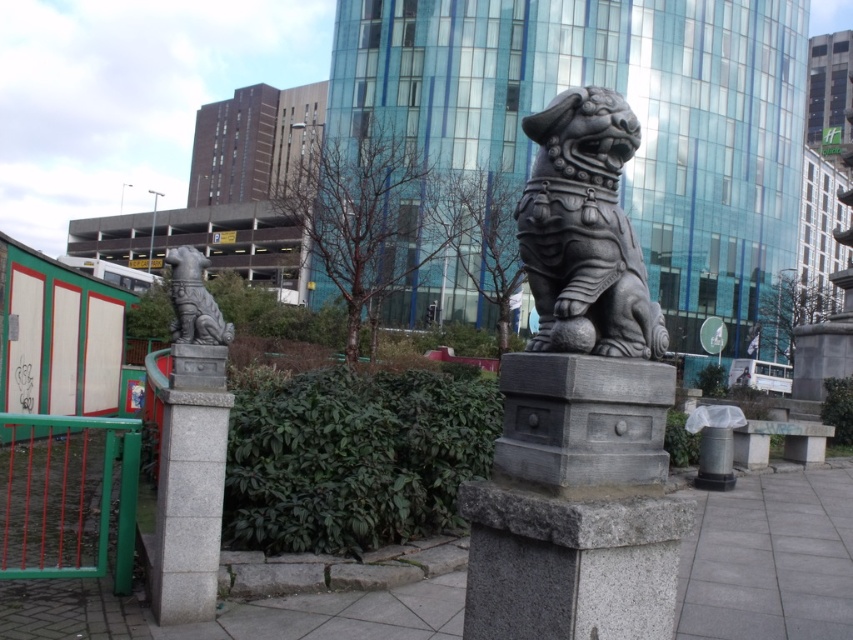
Measure the distance between gray stone lion at center and camera.

5.77 feet

Between gray stone lion at center and green painted metal fence at lower left, which one appears on the left side from the viewer's perspective?

green painted metal fence at lower left is more to the left.

Who is more distant from viewer, (x=648, y=305) or (x=88, y=492)?

Positioned behind is point (x=88, y=492).

Find the location of a particular element. The image size is (853, 640). gray stone lion at center is located at coordinates (584, 230).

Does gray stone lion at center appear over matte gray stone lion at left?

No.

What do you see at coordinates (584, 230) in the screenshot? The image size is (853, 640). I see `gray stone lion at center` at bounding box center [584, 230].

Locate an element on the screen. The height and width of the screenshot is (640, 853). gray stone lion at center is located at coordinates click(584, 230).

Is green painted metal fence at lower left smaller than matte gray stone lion at left?

Actually, green painted metal fence at lower left might be larger than matte gray stone lion at left.

Between point (113, 420) and point (196, 253), which one is positioned in front?

Point (113, 420) is in front.

The image size is (853, 640). In order to click on green painted metal fence at lower left in this screenshot , I will do `click(67, 496)`.